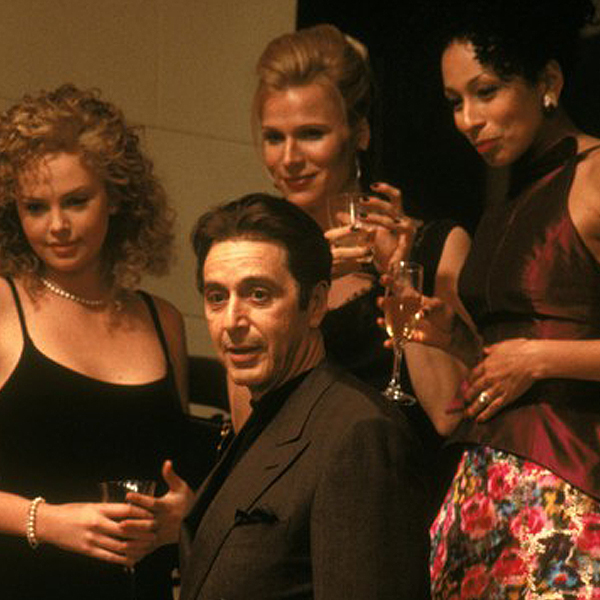
The width and height of the screenshot is (600, 600). I want to click on cup, so click(115, 497), click(351, 204), click(398, 334).